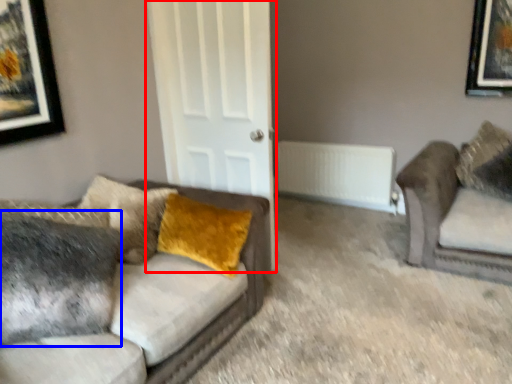
Question: Which of the following is the farthest to the observer, door (highlighted by a red box) or pillow (highlighted by a blue box)?

Choices:
 (A) door
 (B) pillow

Answer: (A)